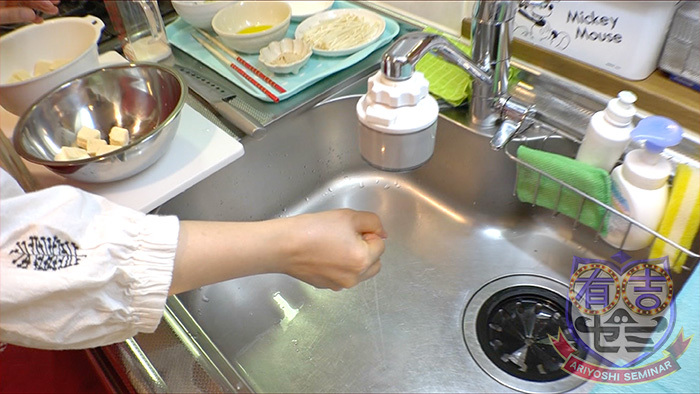
Identify the location of blue chopping board. (308, 77).